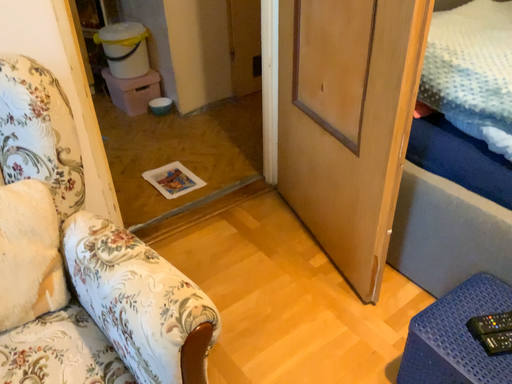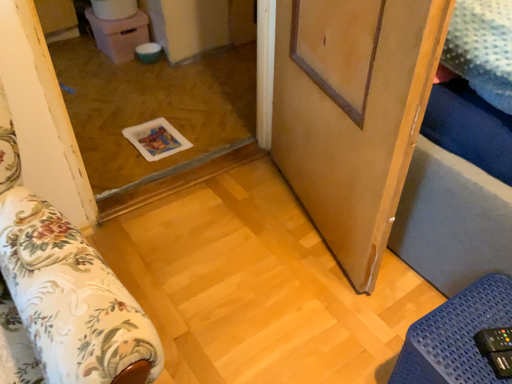
Question: Which way did the camera rotate in the video?

Choices:
 (A) rotated downward
 (B) rotated upward

Answer: (A)